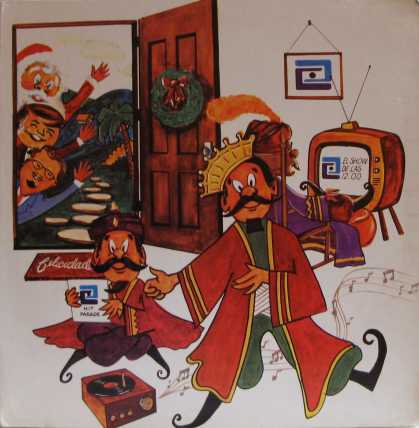
You are a GUI agent. You are given a task and a screenshot of the screen. Output one action in this format:
    pyautogui.click(x=<x>, y=<y>)
    Task: Click on the rocking chair
    
    Given the screenshot: What is the action you would take?
    pyautogui.click(x=322, y=239)